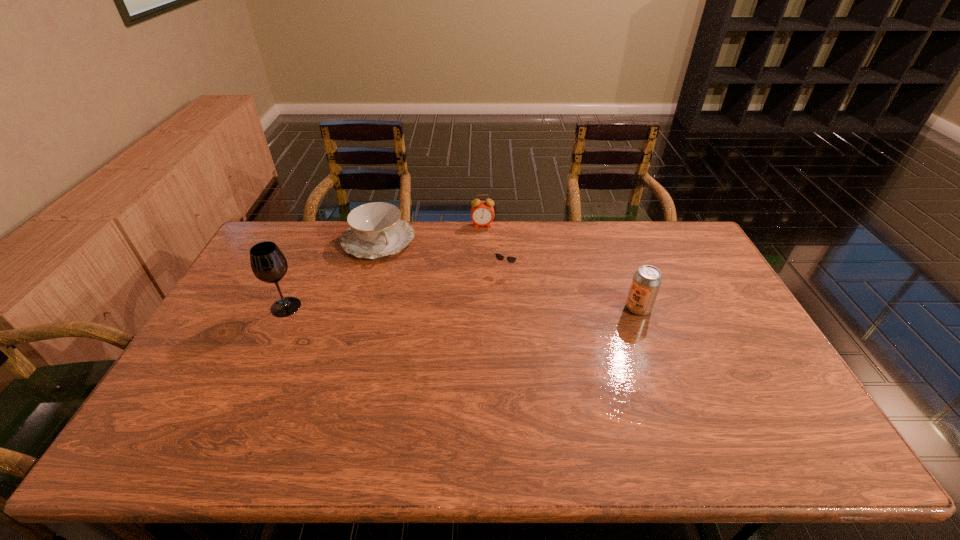
Image resolution: width=960 pixels, height=540 pixels. Identify the location of the leftmost object. (268, 263).

Identify the location of wineglass. This screenshot has height=540, width=960. (268, 263).

At what (x,y) coordinates should I click in order to perform the action: click on the rightmost object. Please return your answer as a coordinate pair (x, y). Looking at the image, I should click on (647, 280).

The image size is (960, 540). In order to click on the shortest object in this screenshot , I will do `click(511, 259)`.

Find the location of a particular element. Image resolution: width=960 pixels, height=540 pixels. alarm clock is located at coordinates (482, 212).

This screenshot has height=540, width=960. Identify the location of the second shortest object. (375, 230).

The height and width of the screenshot is (540, 960). I want to click on the fourth object from right to left, so click(x=375, y=230).

Where is `vacant space located 0.250m on the right of the leftmost object`? The height and width of the screenshot is (540, 960). vacant space located 0.250m on the right of the leftmost object is located at coordinates (382, 307).

I want to click on free space located on the front of the rightmost object, so click(x=657, y=357).

At what (x,y) coordinates should I click in order to perform the action: click on vacant space located 0.190m in front of the lenses of the sunglasses. Please return your answer as a coordinate pair (x, y). The height and width of the screenshot is (540, 960). Looking at the image, I should click on (477, 318).